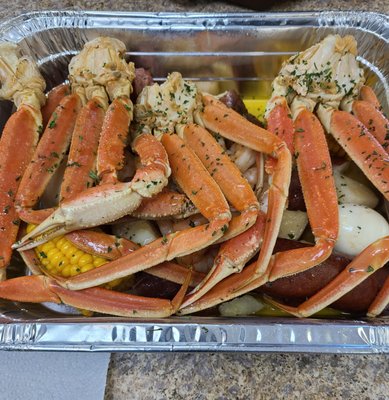
You are a GUI agent. You are given a task and a screenshot of the screen. Output one action in this format:
    pyautogui.click(x=<x>, y=<y>)
    Task: Click on the countertop
    This screenshot has width=389, height=400.
    Given the screenshot: What is the action you would take?
    pyautogui.click(x=191, y=380)